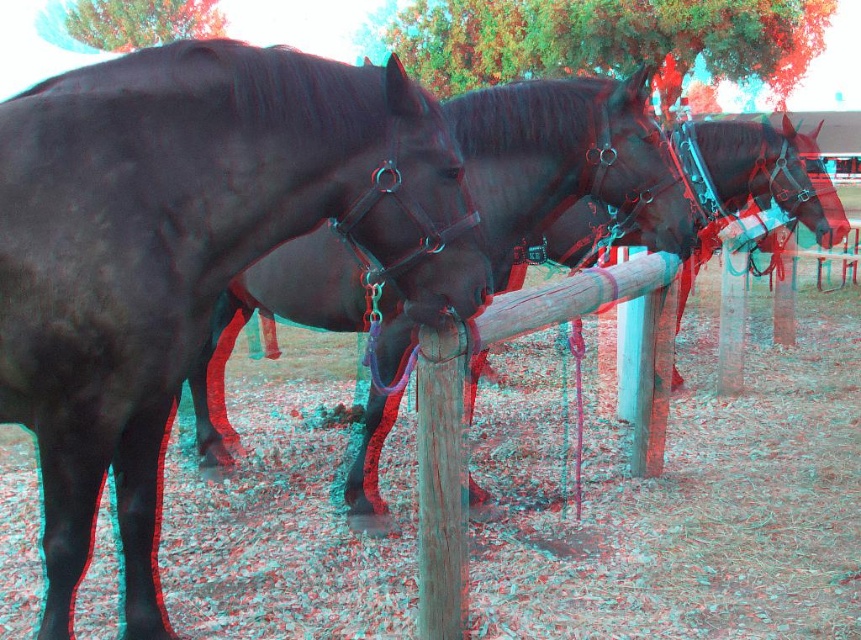
Consider the image. Can you confirm if shiny black horse at center is wider than wooden post at center?

Correct, the width of shiny black horse at center exceeds that of wooden post at center.

Measure the distance between point [632,129] and camera.

3.51 meters

Locate an element on the screen. The width and height of the screenshot is (861, 640). shiny black horse at center is located at coordinates (567, 164).

Measure the distance from shiny black horse at left to shiny black horse at center.

A distance of 3.93 feet exists between shiny black horse at left and shiny black horse at center.

Which of these two, shiny black horse at left or shiny black horse at center, stands shorter?

Standing shorter between the two is shiny black horse at center.

I want to click on shiny black horse at left, so (189, 253).

Is shiny black horse at left bigger than wooden post at center?

Yes.

Who is positioned more to the right, shiny black horse at left or wooden post at center?

Positioned to the right is wooden post at center.

What do you see at coordinates (189, 253) in the screenshot?
I see `shiny black horse at left` at bounding box center [189, 253].

The width and height of the screenshot is (861, 640). I want to click on shiny black horse at left, so click(189, 253).